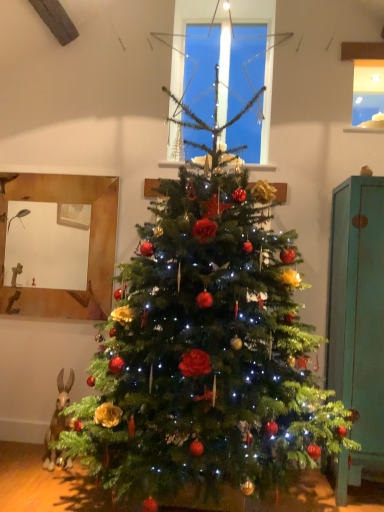
Question: From the image's perspective, is clear glass window at upper center located above teal wood cabinet at right?

Choices:
 (A) yes
 (B) no

Answer: (A)

Question: Is clear glass window at upper center taller than teal wood cabinet at right?

Choices:
 (A) no
 (B) yes

Answer: (A)

Question: Does clear glass window at upper center have a larger size compared to teal wood cabinet at right?

Choices:
 (A) no
 (B) yes

Answer: (A)

Question: Is the depth of clear glass window at upper center greater than that of teal wood cabinet at right?

Choices:
 (A) no
 (B) yes

Answer: (B)

Question: Is clear glass window at upper center facing away from teal wood cabinet at right?

Choices:
 (A) no
 (B) yes

Answer: (A)

Question: Can you confirm if clear glass window at upper center is positioned to the right of teal wood cabinet at right?

Choices:
 (A) yes
 (B) no

Answer: (B)

Question: Does teal wood cabinet at right have a larger size compared to clear glass window at upper center?

Choices:
 (A) no
 (B) yes

Answer: (B)

Question: Is teal wood cabinet at right completely or partially outside of clear glass window at upper center?

Choices:
 (A) yes
 (B) no

Answer: (A)

Question: Is the depth of teal wood cabinet at right less than that of clear glass window at upper center?

Choices:
 (A) no
 (B) yes

Answer: (B)

Question: Is teal wood cabinet at right with clear glass window at upper center?

Choices:
 (A) yes
 (B) no

Answer: (B)

Question: Does teal wood cabinet at right have a greater height compared to clear glass window at upper center?

Choices:
 (A) no
 (B) yes

Answer: (B)

Question: From the image's perspective, is teal wood cabinet at right on top of clear glass window at upper center?

Choices:
 (A) yes
 (B) no

Answer: (B)

Question: From a real-world perspective, is teal wood cabinet at right positioned above or below clear glass window at upper center?

Choices:
 (A) above
 (B) below

Answer: (B)